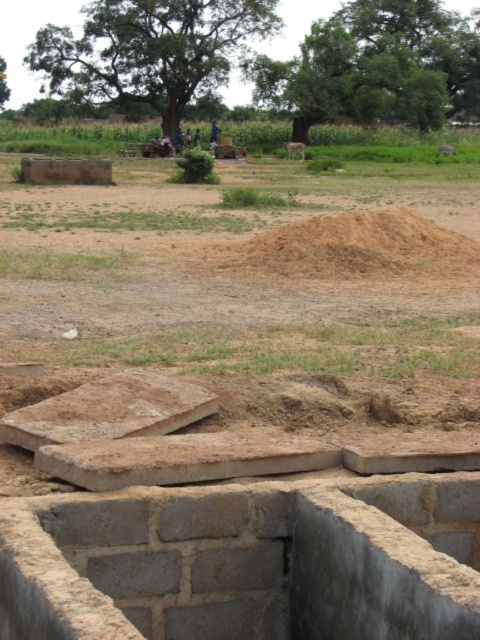
You are a construction worker who needs to place a heavy equipment on the ground. The equipment requires a stable and level surface. Based on the scene, which location between the gray brick foundation at lower center and the brown sandy mound at center would be more suitable for placing the equipment?

The gray brick foundation at lower center is much taller than the brown sandy mound at center, so it would provide a more stable and level surface for placing the heavy equipment.

You are a construction worker who needs to place a 2x4 wooden beam horizontally between the gray brick foundation at lower center and the brown sandy mound at center. Can the beam fit between them based on their widths?

The gray brick foundation at lower center is wider than the brown sandy mound at center, so the 2x4 wooden beam can fit horizontally between them since the foundation is wider, providing enough space.

You are standing at the viewpoint of the image and want to place a small flag at both point (96, 524) and point (355, 216). Which point will require you to walk further to reach?

Point (355, 216) is further away from the viewer than point (96, 524), so you will need to walk further to reach point (355, 216).